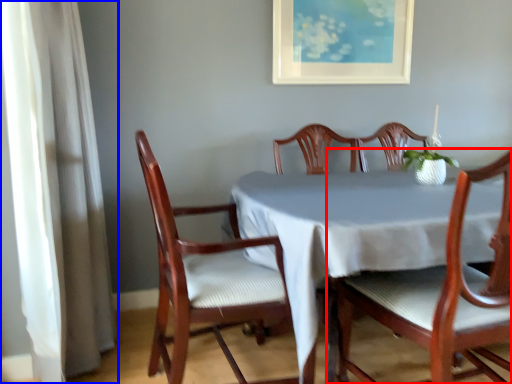
Question: Which of the following is the farthest to the observer, chair (highlighted by a red box) or curtain (highlighted by a blue box)?

Choices:
 (A) chair
 (B) curtain

Answer: (B)